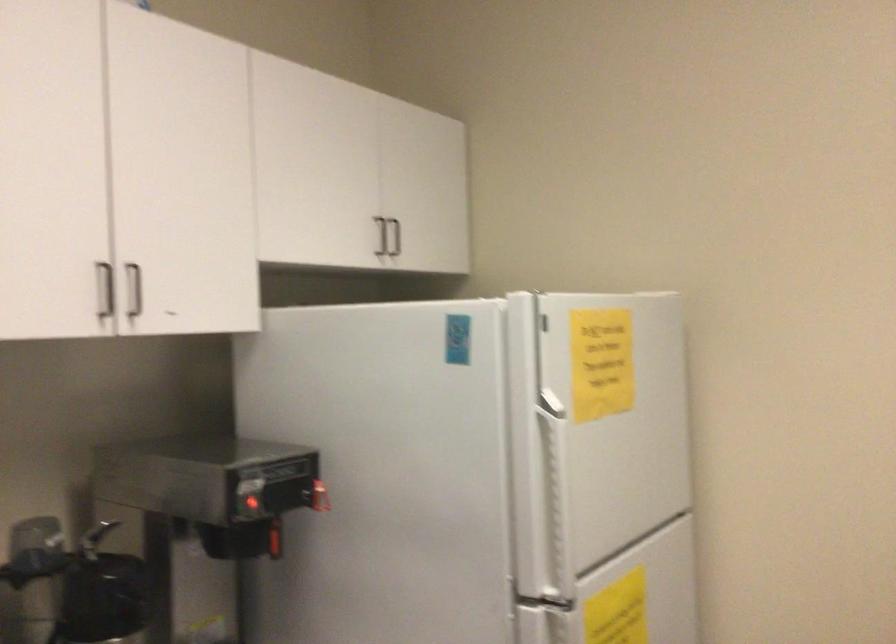
Describe the element at coordinates (273, 541) in the screenshot. I see `a red dispenser lever` at that location.